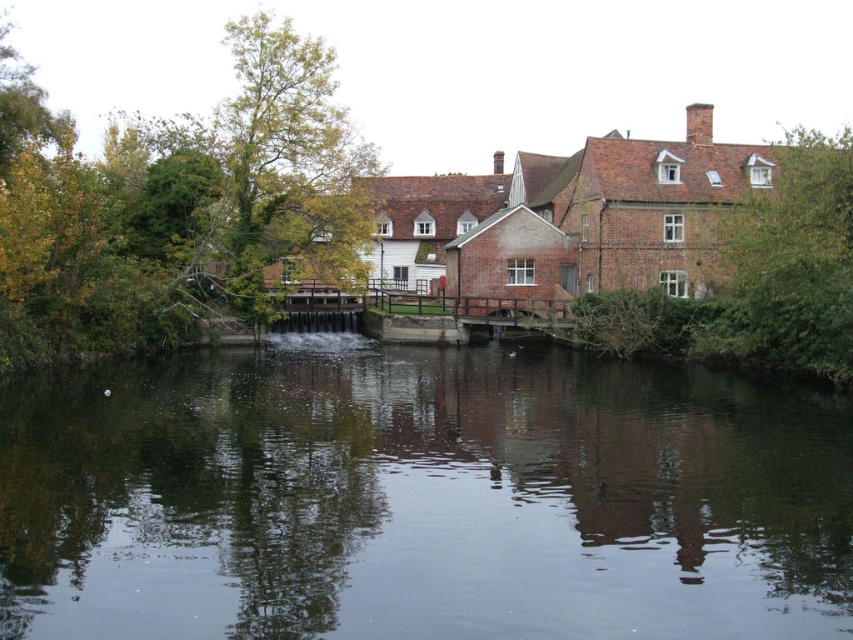
Does point (57, 147) come farther from viewer compared to point (766, 218)?

Yes, it is.

Is green leafy tree at center below brown textured tree at right?

Incorrect, green leafy tree at center is not positioned below brown textured tree at right.

Is point (12, 307) positioned after point (714, 349)?

No.

Find the location of a particular element. green leafy tree at center is located at coordinates (175, 204).

Does point (490, 490) lie in front of point (315, 228)?

Yes, point (490, 490) is closer to viewer.

Who is lower down, dark reflective water at center or green leafy tree at center?

Positioned lower is dark reflective water at center.

Who is more distant from viewer, (x=409, y=392) or (x=4, y=248)?

Positioned behind is point (x=409, y=392).

Identify the location of dark reflective water at center. This screenshot has width=853, height=640. (421, 497).

What do you see at coordinates (421, 497) in the screenshot?
I see `dark reflective water at center` at bounding box center [421, 497].

Does dark reflective water at center appear over brown textured tree at right?

Actually, dark reflective water at center is below brown textured tree at right.

Between point (833, 625) and point (830, 140), which one is positioned behind?

Point (830, 140)

Locate an element on the screen. Image resolution: width=853 pixels, height=640 pixels. dark reflective water at center is located at coordinates (421, 497).